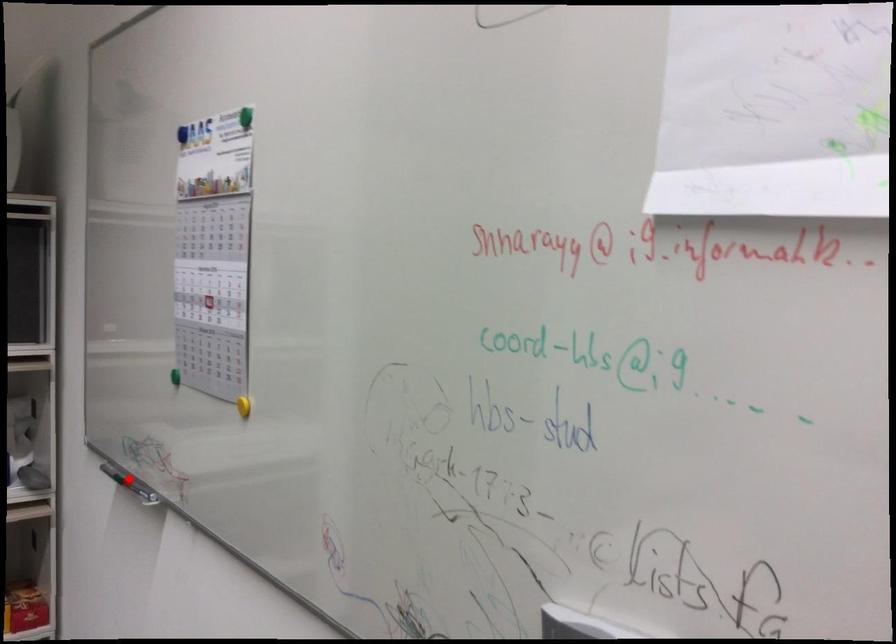
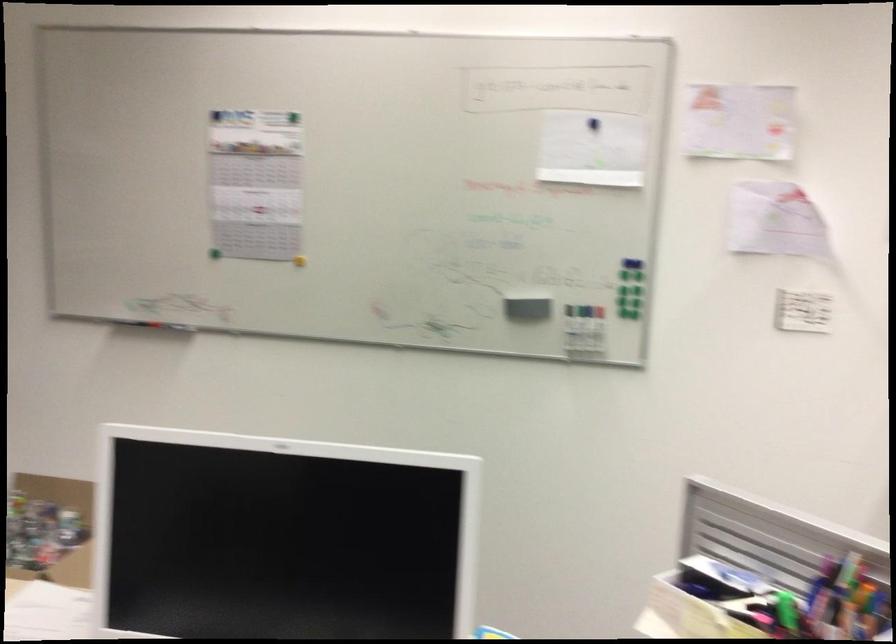
Question: I am providing you with two images of the same scene from different viewpoints. Given a red point in image1, look at the same physical point in image2. Is it:

Choices:
 (A) Closer to the viewpoint
 (B) Farther from the viewpoint

Answer: (B)